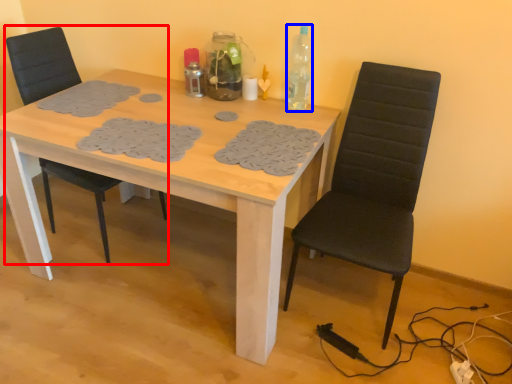
Question: Which of the following is the closest to the observer, chair (highlighted by a red box) or bottle (highlighted by a blue box)?

Choices:
 (A) chair
 (B) bottle

Answer: (A)